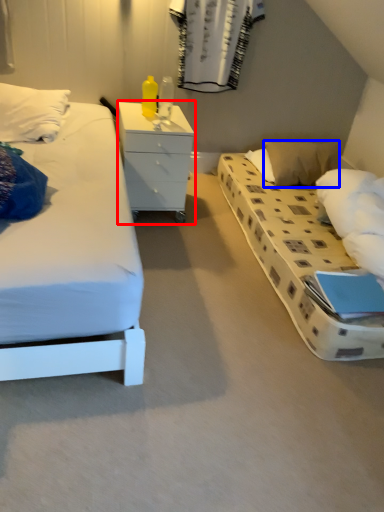
Question: Among these objects, which one is farthest to the camera, chest of drawers (highlighted by a red box) or pillow (highlighted by a blue box)?

Choices:
 (A) chest of drawers
 (B) pillow

Answer: (B)